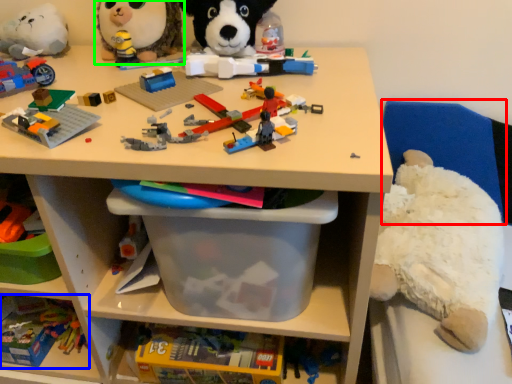
Question: Which object is the closest to the chair (highlighted by a red box)? Choose among these: toy (highlighted by a blue box) or toy (highlighted by a green box).

Choices:
 (A) toy
 (B) toy

Answer: (B)